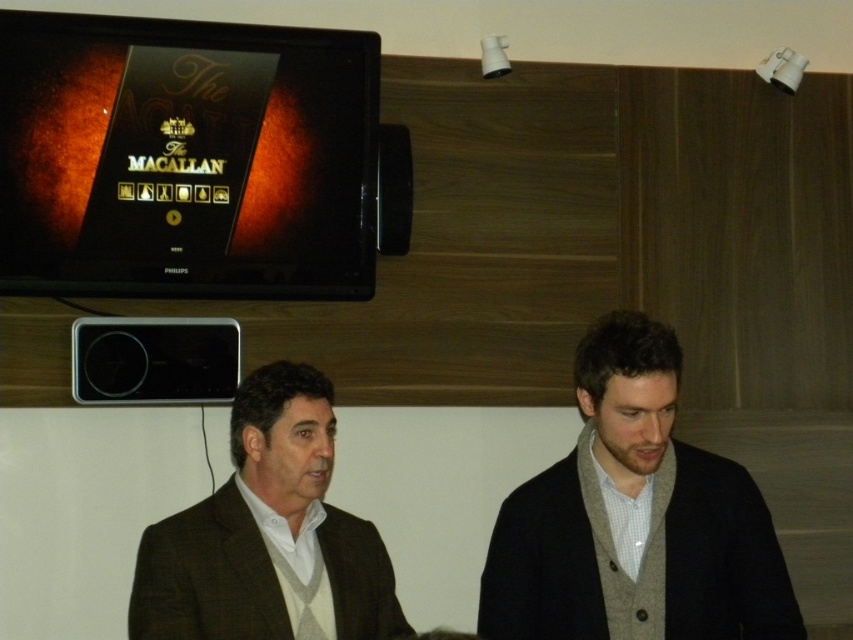
What do you see at coordinates (267, 532) in the screenshot? Image resolution: width=853 pixels, height=640 pixels. I see `brown woolen sweater at center` at bounding box center [267, 532].

Is point (242, 634) farther from viewer compared to point (222, 394)?

No, it is in front of (222, 394).

Where is `brown woolen sweater at center`? brown woolen sweater at center is located at coordinates (267, 532).

Between black plastic speaker at upper left and black plastic speaker at upper center, which one has more height?

black plastic speaker at upper center is taller.

The width and height of the screenshot is (853, 640). What do you see at coordinates (154, 358) in the screenshot?
I see `black plastic speaker at upper left` at bounding box center [154, 358].

Where is `black plastic speaker at upper left`? This screenshot has width=853, height=640. black plastic speaker at upper left is located at coordinates (154, 358).

Identify the location of black plastic speaker at upper left. (154, 358).

This screenshot has width=853, height=640. What are the coordinates of `brown woolen sweater at center` in the screenshot? It's located at (267, 532).

Which is in front, point (292, 496) or point (410, 147)?

Point (292, 496) is more forward.

Who is more forward, (318, 451) or (380, 211)?

Point (318, 451) is more forward.

This screenshot has width=853, height=640. Find the location of `brown woolen sweater at center`. brown woolen sweater at center is located at coordinates (267, 532).